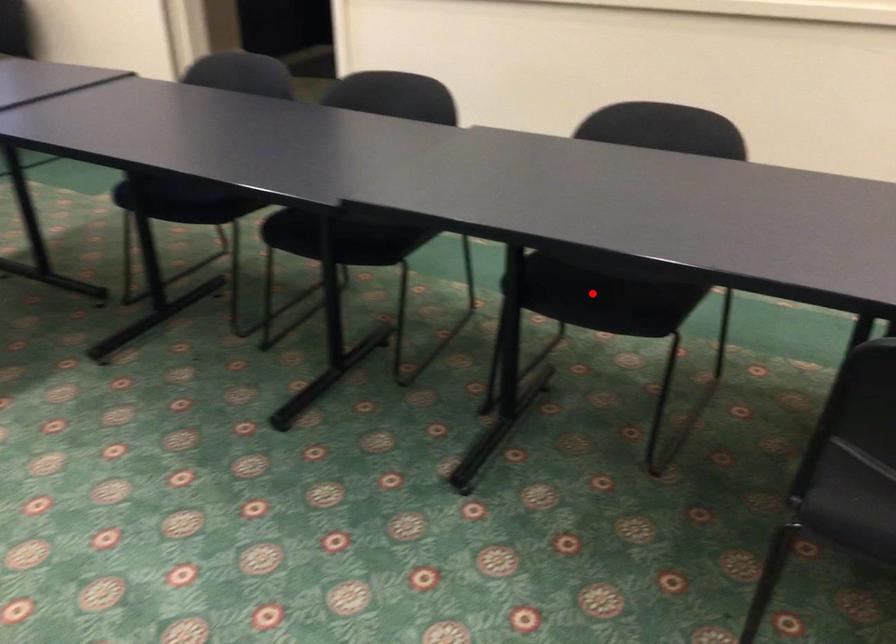
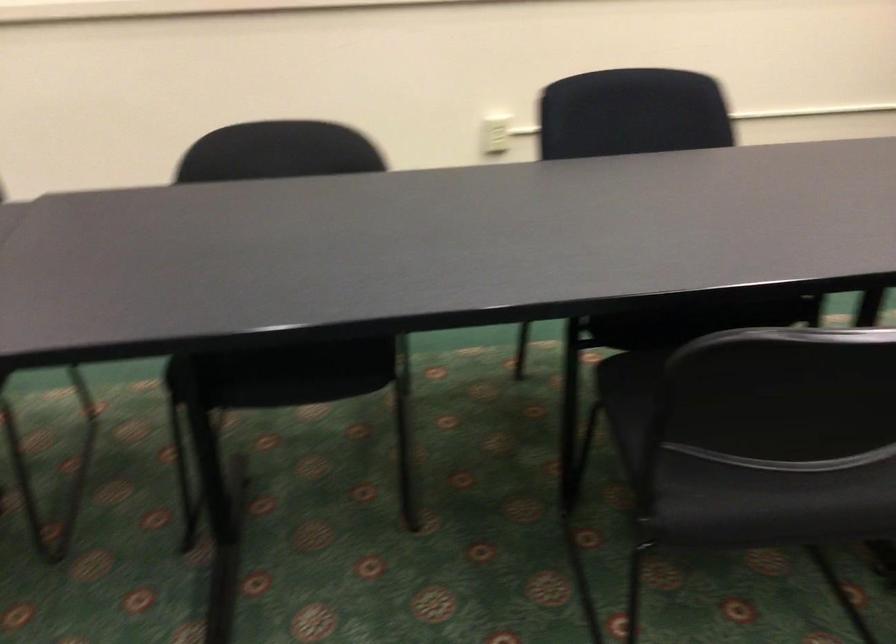
Locate, in the second image, the point that corresponds to the highlighted location in the first image.

(291, 363)